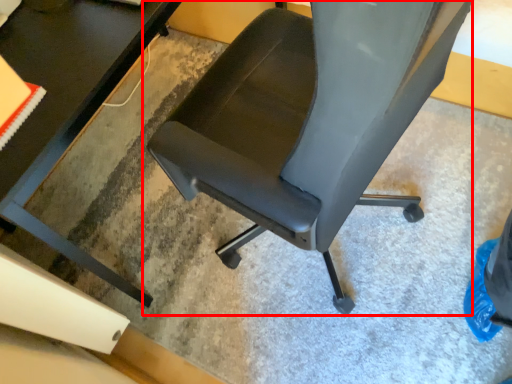
Question: Observing the image, what is the correct spatial positioning of chair (annotated by the red box) in reference to table?

Choices:
 (A) left
 (B) right

Answer: (B)